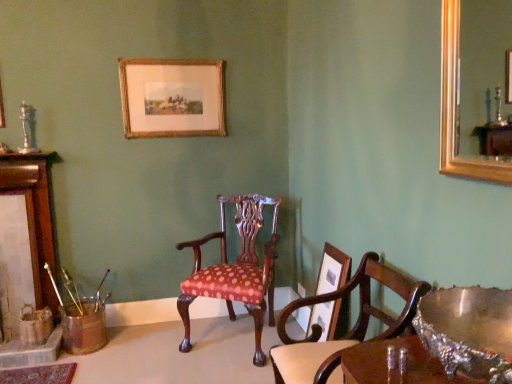
Question: From the image's perspective, is polka dot fabric chair at center, which ranks as the 1th chair in back-to-front order, located above or below wooden picture frame at center, placed as the first picture frame when sorted from front to back?

Choices:
 (A) below
 (B) above

Answer: (A)

Question: Considering the positions of polka dot fabric chair at center, which ranks as the 1th chair in back-to-front order, and wooden picture frame at center, which appears as the second picture frame when viewed from the back, in the image, is polka dot fabric chair at center, which ranks as the 1th chair in back-to-front order, wider or thinner than wooden picture frame at center, which appears as the second picture frame when viewed from the back,?

Choices:
 (A) thin
 (B) wide

Answer: (B)

Question: Estimate the real-world distances between objects in this image. Which object is closer to the polka dot fabric chair at center, which appears as the 1th chair when viewed from the front?

Choices:
 (A) brushed metal fireplace at left
 (B) shiny silver bowl at lower right
 (C) gold-framed print at upper center, which ranks as the 1th picture frame in back-to-front order
 (D) wooden picture frame at center, arranged as the 2th picture frame when viewed from the left
 (E) polka dot fabric chair at center, which ranks as the 1th chair in back-to-front order

Answer: (D)

Question: Which is nearer to the polka dot fabric chair at center, which appears as the 1th chair when viewed from the front?

Choices:
 (A) polka dot fabric chair at center, which ranks as the 1th chair in back-to-front order
 (B) shiny silver bowl at lower right
 (C) brushed metal fireplace at left
 (D) gold-framed print at upper center, positioned as the second picture frame in bottom-to-top order
 (E) wooden picture frame at center, arranged as the 1th picture frame when viewed from the right

Answer: (E)